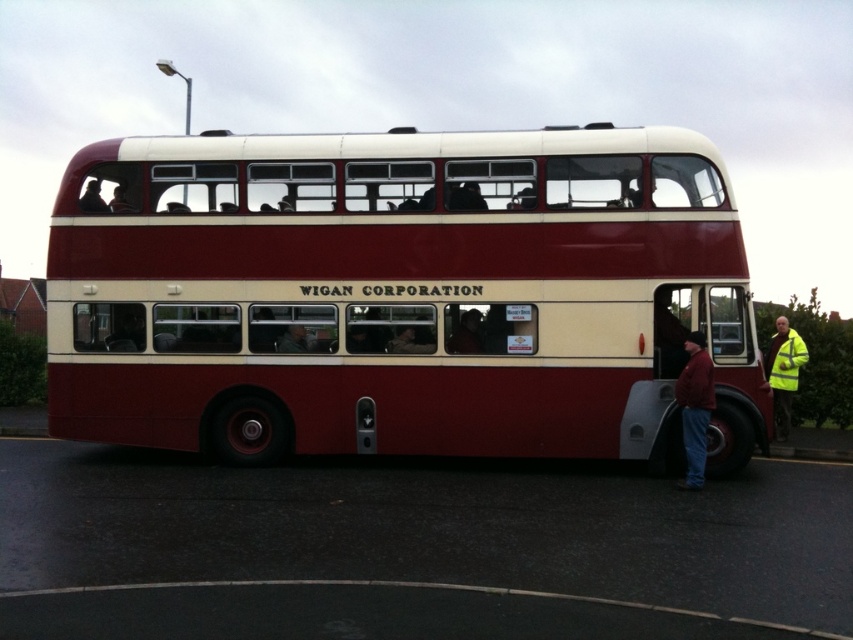
Question: Estimate the real-world distances between objects in this image. Which object is farther from the yellow reflective vest at lower right?

Choices:
 (A) red jacket at lower right
 (B) black asphalt at lower center

Answer: (B)

Question: Which of the following is the farthest from the observer?

Choices:
 (A) black asphalt at lower center
 (B) smooth black hair at upper left
 (C) yellow reflective vest at lower right
 (D) red jacket at lower right

Answer: (C)

Question: Does black asphalt at lower center appear over yellow reflective vest at lower right?

Choices:
 (A) yes
 (B) no

Answer: (B)

Question: From the image, what is the correct spatial relationship of black asphalt at lower center in relation to yellow reflective vest at lower right?

Choices:
 (A) above
 (B) below

Answer: (B)

Question: Which of these objects is positioned closest to the maroon matte double-decker bus at center?

Choices:
 (A) yellow reflective vest at lower right
 (B) smooth black hair at upper left
 (C) red jacket at lower right
 (D) black asphalt at lower center

Answer: (D)

Question: In this image, where is maroon matte double-decker bus at center located relative to yellow reflective vest at lower right?

Choices:
 (A) right
 (B) left

Answer: (B)